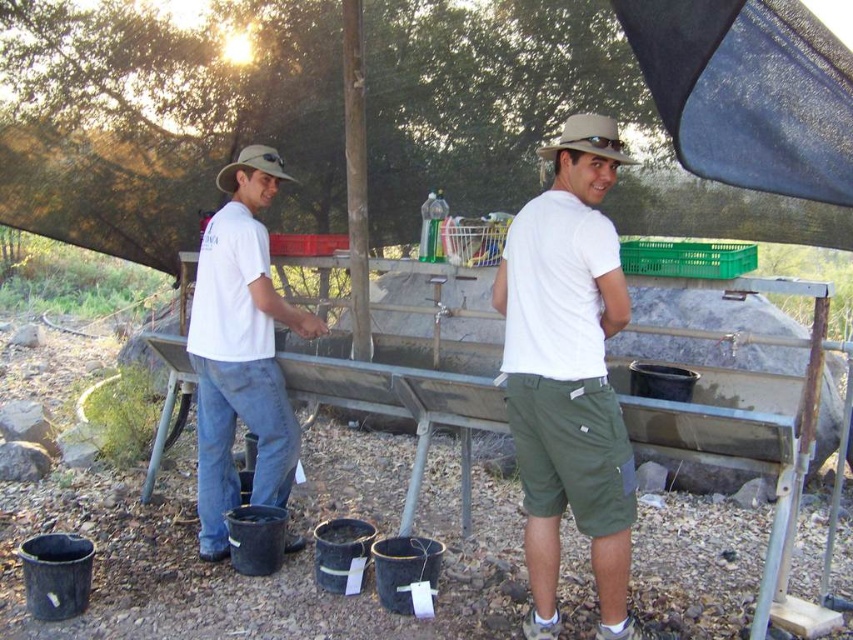
You are a photographer trying to capture a candid shot of the two people under the tarp. You notice the white cotton shirt at center and the denim jeans at left. Which clothing item is located to the right of the other?

The white cotton shirt at center is positioned on the right side of denim jeans at left.

You are standing at the point with coordinates point (569, 372). What object are you currently standing on?

You are standing on the white cotton shirt at center.

Looking at this image, you are a delivery person who needs to place a package between the white cotton shirt at center and the denim jeans at left. The package is 2 feet wide. Can you fit it between them?

The distance between the white cotton shirt at center and the denim jeans at left is 5.08 feet. Since the package is 2 feet wide, there is enough space to fit it between them.